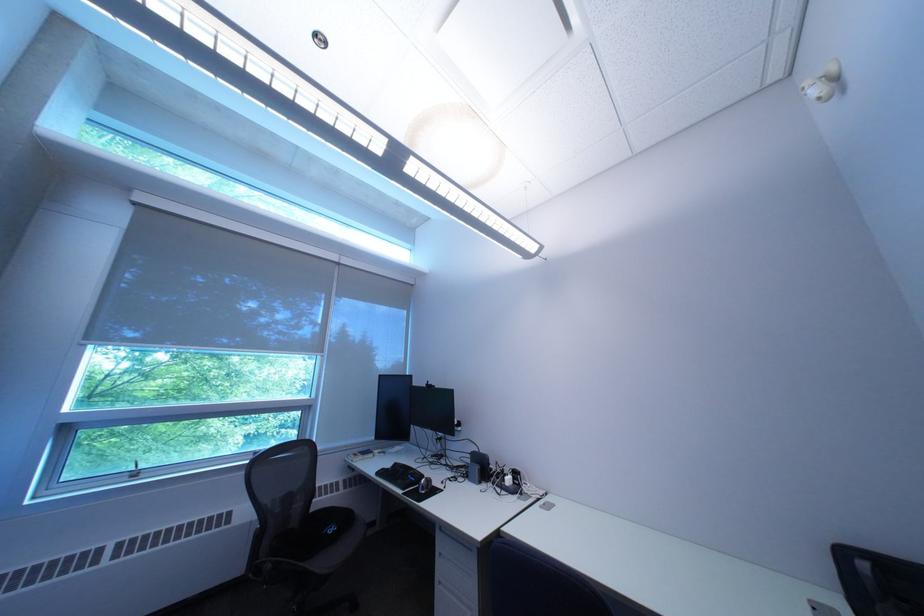
Which object does [438,482] point to?

This point indicates the black computer mouse.